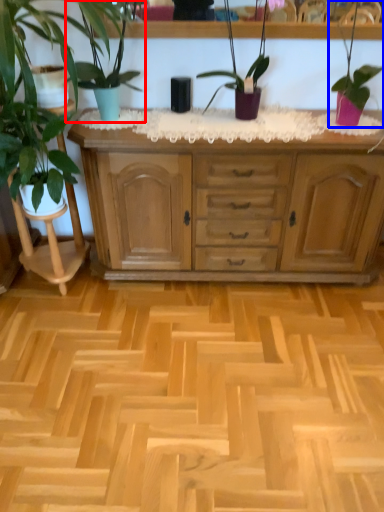
Question: Which object appears closest to the camera in this image, houseplant (highlighted by a red box) or houseplant (highlighted by a blue box)?

Choices:
 (A) houseplant
 (B) houseplant

Answer: (A)